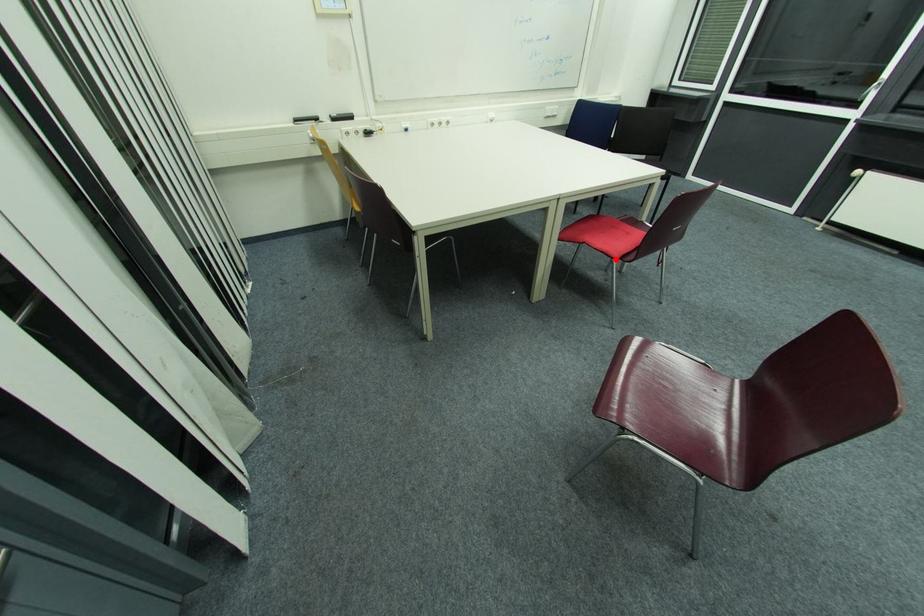
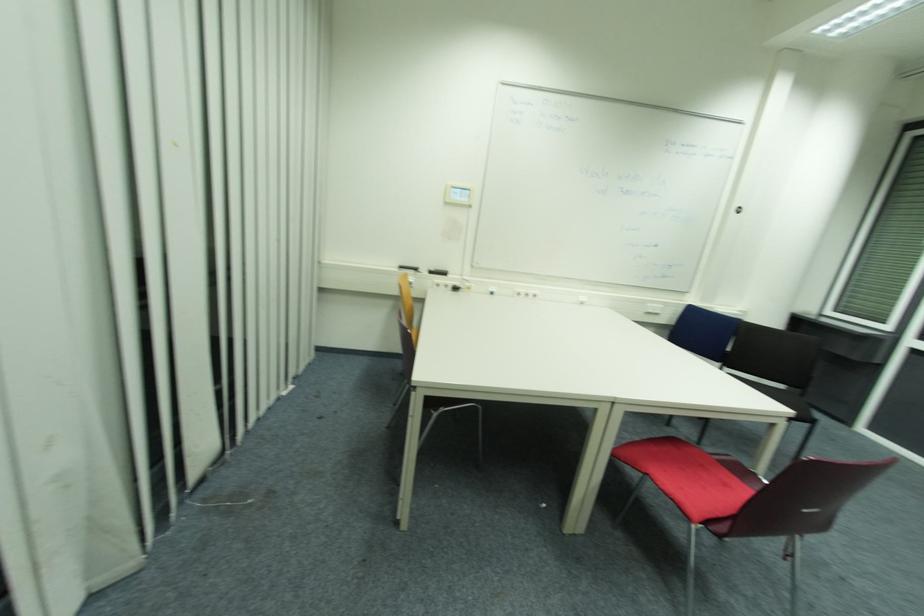
In the second image, find the point that corresponds to the highlighted location in the first image.

(691, 519)